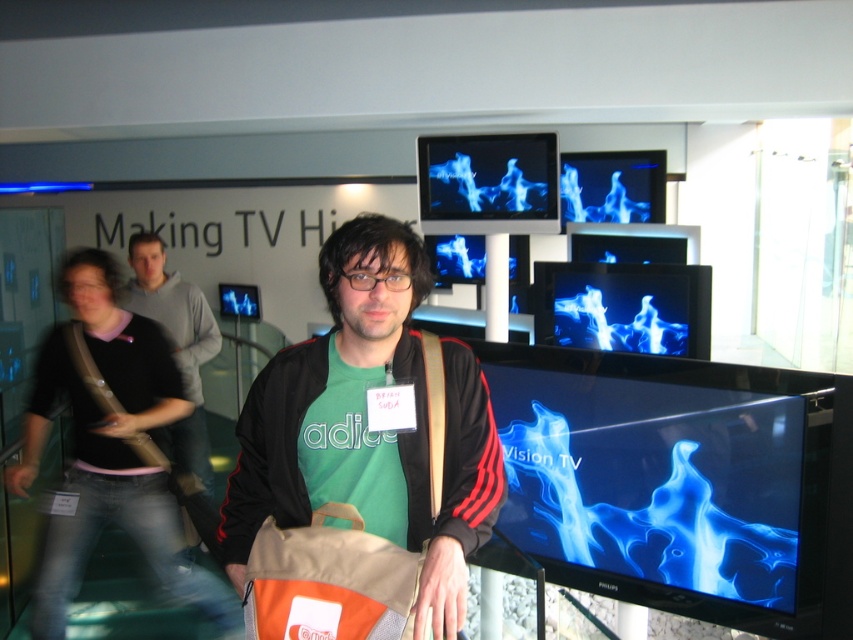
Who is shorter, green fabric shirt at center or green cotton t-shirt at center?

Standing shorter between the two is green fabric shirt at center.

Does green fabric shirt at center come behind green cotton t-shirt at center?

That is False.

Where is `green fabric shirt at center`? This screenshot has width=853, height=640. green fabric shirt at center is located at coordinates (367, 428).

This screenshot has width=853, height=640. Identify the location of green fabric shirt at center. (367, 428).